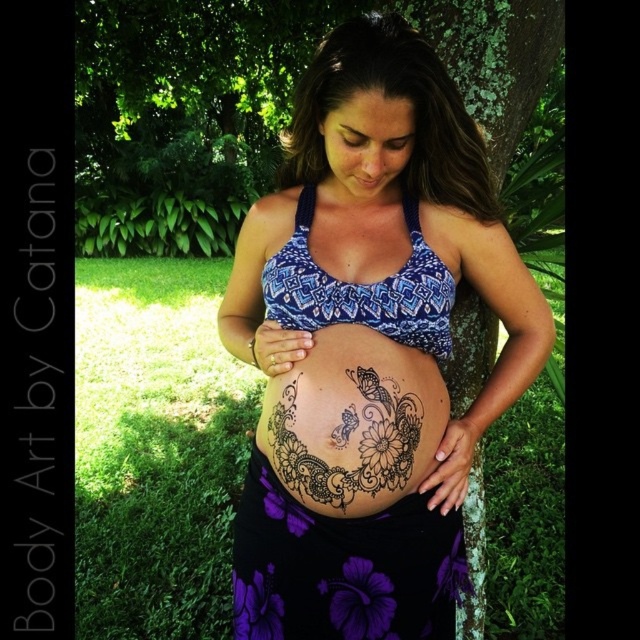
You are a photographer adjusting your camera to focus on two points in the image. The first point is at coordinates point (444,323) and the second is at point (328,490). Which point is closer to the camera?

Point (444,323) is further to the viewer than point (328,490), so the second point is closer to the camera.

You are a photographer taking a closeup shot of the woman in the garden. You want to ensure that both the matte blue bikini top at center and the black henna tattoo at center are clearly visible in the frame. Which object should you focus on first to ensure both are in focus, considering their positions?

The matte blue bikini top at center is positioned on the right side of the black henna tattoo at center. To ensure both are in focus, you should focus on the black henna tattoo at center first since it is closer to the camera, allowing the bikini top to remain in focus as well.

Where is the matte blue bikini top at center located in the image?

The matte blue bikini top at center is located at point coordinates of (369,346).